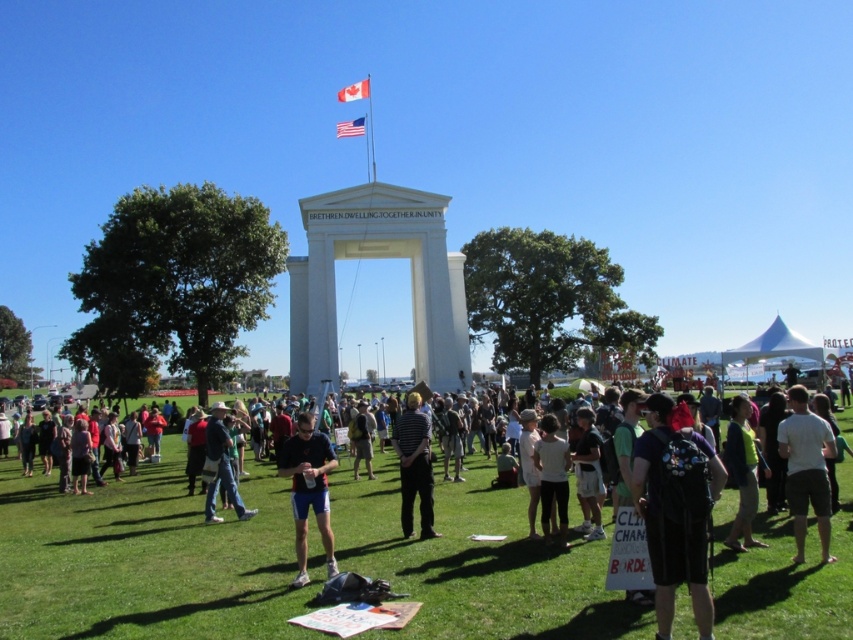
Question: Which object is farther from the camera taking this photo?

Choices:
 (A) denim jacket at center
 (B) green fabric jacket at lower right
 (C) white cotton shirt at lower right
 (D) white cotton shirt at center

Answer: (A)

Question: Does white cotton shirt at center come in front of dark blue shirt at center?

Choices:
 (A) no
 (B) yes

Answer: (B)

Question: Considering the real-world distances, which object is farthest from the white cotton shirt at center?

Choices:
 (A) dark blue shirt at center
 (B) dark gray backpack at center
 (C) green grass at lower center
 (D) white cotton shirt at lower right

Answer: (A)

Question: Observing the image, what is the correct spatial positioning of dark gray backpack at center in reference to dark blue t-shirt at center?

Choices:
 (A) above
 (B) below

Answer: (A)

Question: Does denim jacket at center have a smaller size compared to dark blue shirt at center?

Choices:
 (A) no
 (B) yes

Answer: (A)

Question: Which object is positioned farthest from the american flag at upper center?

Choices:
 (A) denim jacket at center
 (B) green fabric jacket at lower right
 (C) dark gray backpack at center

Answer: (C)